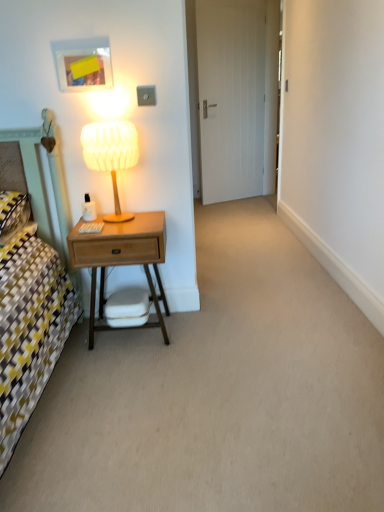
Question: Would you consider white matte door at center to be distant from wooden nightstand at left?

Choices:
 (A) yes
 (B) no

Answer: (A)

Question: Is white matte door at center closer to the viewer compared to wooden nightstand at left?

Choices:
 (A) no
 (B) yes

Answer: (A)

Question: Can you confirm if white matte door at center is positioned to the right of wooden nightstand at left?

Choices:
 (A) yes
 (B) no

Answer: (A)

Question: From a real-world perspective, is white matte door at center physically above wooden nightstand at left?

Choices:
 (A) no
 (B) yes

Answer: (B)

Question: Considering the relative sizes of white matte door at center and wooden nightstand at left in the image provided, is white matte door at center taller than wooden nightstand at left?

Choices:
 (A) yes
 (B) no

Answer: (A)

Question: Considering the relative positions of white matte door at center and wooden nightstand at left in the image provided, is white matte door at center to the left of wooden nightstand at left from the viewer's perspective?

Choices:
 (A) yes
 (B) no

Answer: (B)

Question: From a real-world perspective, is wooden table lamp at left physically above white matte swivel chair at center?

Choices:
 (A) yes
 (B) no

Answer: (A)

Question: Is wooden table lamp at left positioned in front of white matte swivel chair at center?

Choices:
 (A) yes
 (B) no

Answer: (A)

Question: From a real-world perspective, is wooden table lamp at left under white matte swivel chair at center?

Choices:
 (A) yes
 (B) no

Answer: (B)

Question: Considering the relative sizes of wooden table lamp at left and white matte swivel chair at center in the image provided, is wooden table lamp at left wider than white matte swivel chair at center?

Choices:
 (A) no
 (B) yes

Answer: (B)

Question: Is wooden table lamp at left oriented towards white matte swivel chair at center?

Choices:
 (A) no
 (B) yes

Answer: (A)

Question: Is wooden table lamp at left thinner than white matte swivel chair at center?

Choices:
 (A) no
 (B) yes

Answer: (A)

Question: Is white matte swivel chair at center located outside wooden nightstand at left?

Choices:
 (A) no
 (B) yes

Answer: (A)